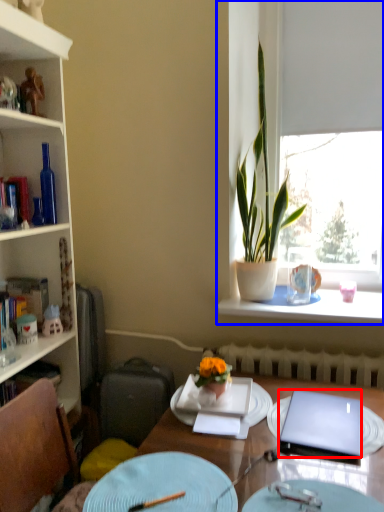
Question: Which point is closer to the camera, laptop (highlighted by a red box) or window (highlighted by a blue box)?

Choices:
 (A) laptop
 (B) window

Answer: (A)